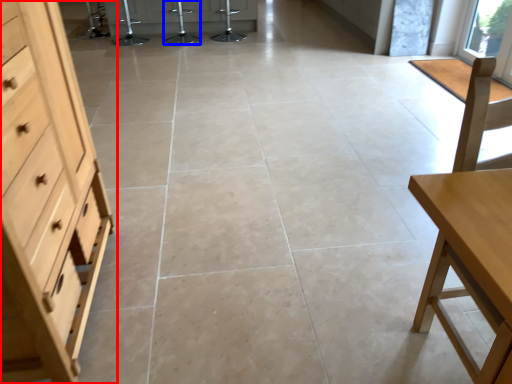
Question: Which point is closer to the camera, chest of drawers (highlighted by a red box) or bar stool (highlighted by a blue box)?

Choices:
 (A) chest of drawers
 (B) bar stool

Answer: (A)